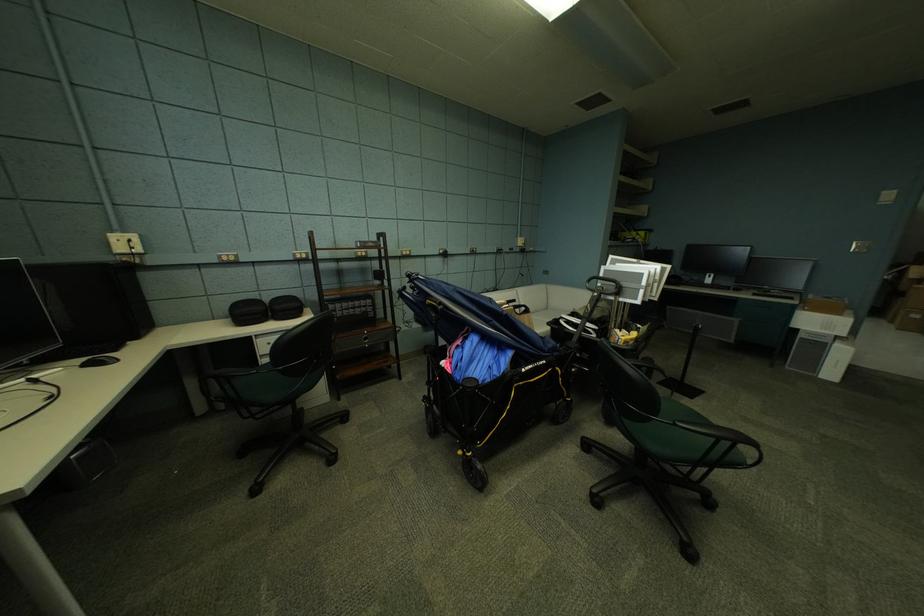
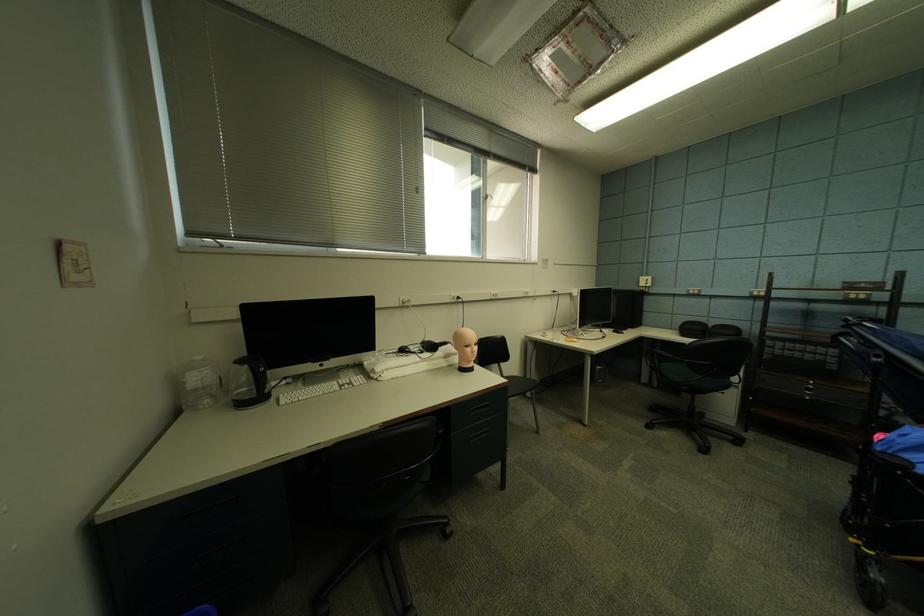
Find the pixel in the second image that matches (122,241) in the first image.

(650, 282)